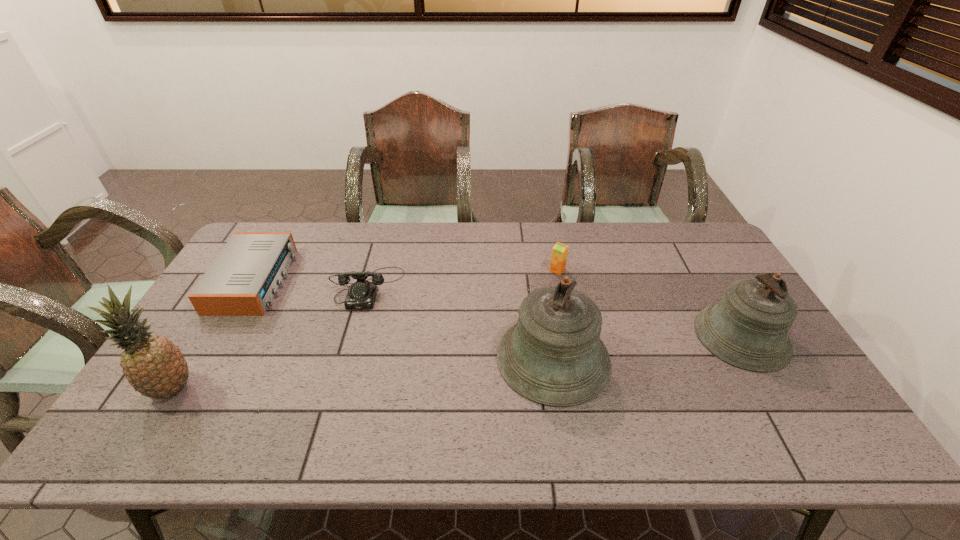
Locate an element on the screen. vacant space that satisfies the following two spatial constraints: 1. on the front panel of the radio receiver; 2. on the front side of the pineapple is located at coordinates (191, 389).

Locate an element on the screen. The width and height of the screenshot is (960, 540). blank space that satisfies the following two spatial constraints: 1. on the front panel of the radio receiver; 2. on the right side of the rightmost object is located at coordinates (222, 336).

Where is `vacant space that satisfies the following two spatial constraints: 1. on the back side of the shorter bell; 2. on the front panel of the radio receiver`? vacant space that satisfies the following two spatial constraints: 1. on the back side of the shorter bell; 2. on the front panel of the radio receiver is located at coordinates (708, 280).

Find the location of a particular element. The height and width of the screenshot is (540, 960). free space that satisfies the following two spatial constraints: 1. on the front-facing side of the taller bell; 2. on the left side of the third object from left to right is located at coordinates (347, 358).

The height and width of the screenshot is (540, 960). I want to click on free space that satisfies the following two spatial constraints: 1. on the back side of the fourth tallest object; 2. on the left side of the left bell, so [540, 270].